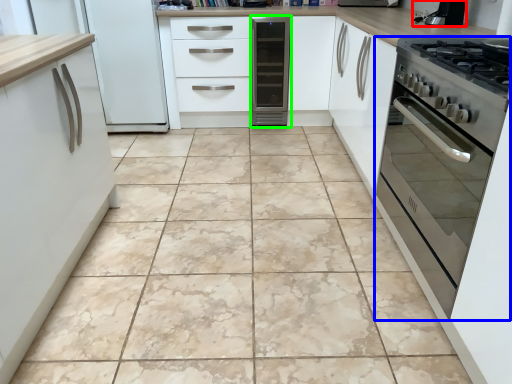
Question: Which object is the farthest from appliance (highlighted by a red box)? Choose among these: oven (highlighted by a blue box) or home appliance (highlighted by a green box).

Choices:
 (A) oven
 (B) home appliance

Answer: (B)